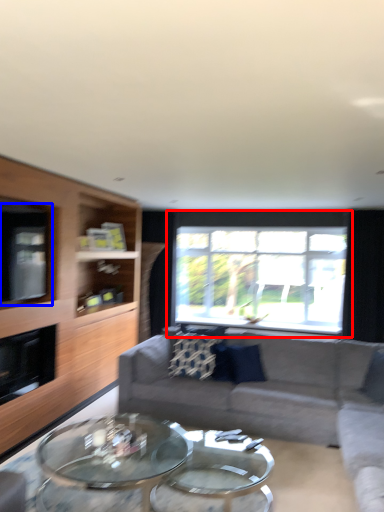
Question: Which object appears closest to the camera in this image, window (highlighted by a red box) or window screen (highlighted by a blue box)?

Choices:
 (A) window
 (B) window screen

Answer: (B)